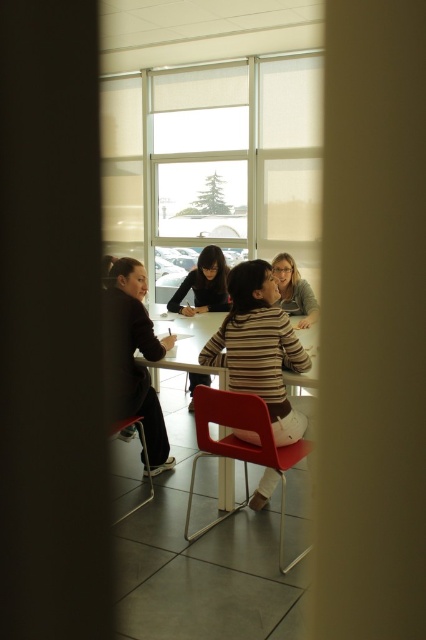
Is transparent glass window at upper center positioned before striped fabric shirt at center?

That is False.

Is point (250, 256) positioned before point (259, 484)?

No, it is behind (259, 484).

Between point (261, 138) and point (236, 333), which one is positioned behind?

Point (261, 138)

I want to click on transparent glass window at upper center, so click(x=215, y=166).

Can you confirm if dark gray sweater at left is smaller than white glossy table at center?

Correct, dark gray sweater at left occupies less space than white glossy table at center.

Who is positioned more to the right, dark gray sweater at left or white glossy table at center?

Positioned to the right is white glossy table at center.

Is point (114, 268) behind point (227, 384)?

Yes.

Where is `dark gray sweater at left`? The image size is (426, 640). dark gray sweater at left is located at coordinates (141, 353).

Does dark gray sweater at left have a greater height compared to matte black shirt at center?

Indeed, dark gray sweater at left has a greater height compared to matte black shirt at center.

Does dark gray sweater at left appear on the right side of matte black shirt at center?

No, dark gray sweater at left is not to the right of matte black shirt at center.

Where is `dark gray sweater at left`? The width and height of the screenshot is (426, 640). dark gray sweater at left is located at coordinates (141, 353).